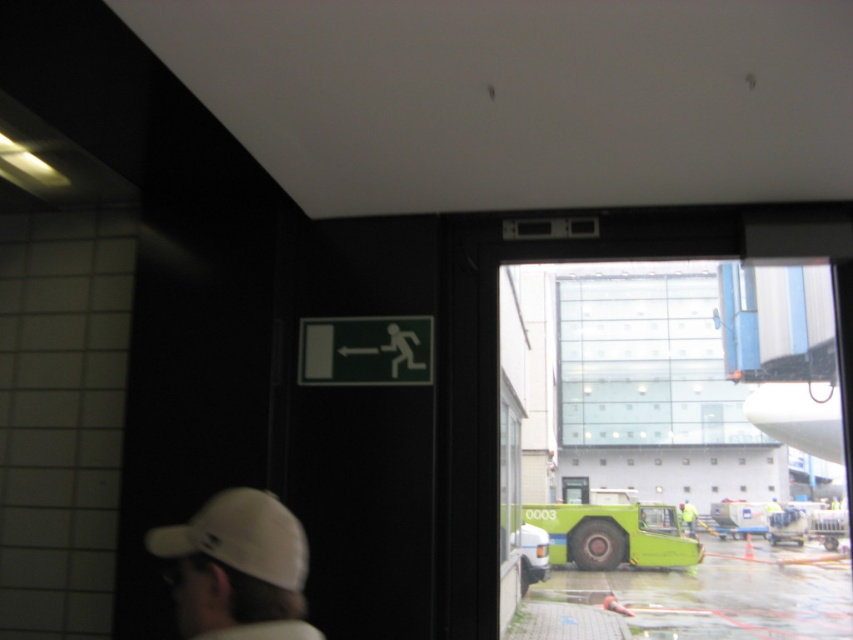
Which is above, transparent glass window at center or white matte baseball cap at lower left?

Positioned higher is white matte baseball cap at lower left.

Which of these two, transparent glass window at center or white matte baseball cap at lower left, stands shorter?

white matte baseball cap at lower left

This screenshot has height=640, width=853. I want to click on transparent glass window at center, so click(645, 362).

Can you confirm if transparent glass window at center is shorter than green matte exit sign at upper center?

No, transparent glass window at center is not shorter than green matte exit sign at upper center.

Is transparent glass window at center wider than green matte exit sign at upper center?

Correct, the width of transparent glass window at center exceeds that of green matte exit sign at upper center.

Between point (604, 340) and point (428, 348), which one is positioned behind?

Positioned behind is point (604, 340).

The height and width of the screenshot is (640, 853). I want to click on transparent glass window at center, so click(645, 362).

Is transparent glass window at center to the left of green rubber tarmac at lower center from the viewer's perspective?

No, transparent glass window at center is not to the left of green rubber tarmac at lower center.

Is transparent glass window at center shorter than green rubber tarmac at lower center?

Incorrect, transparent glass window at center's height does not fall short of green rubber tarmac at lower center's.

Find the location of `transparent glass window at center`. transparent glass window at center is located at coordinates click(x=645, y=362).